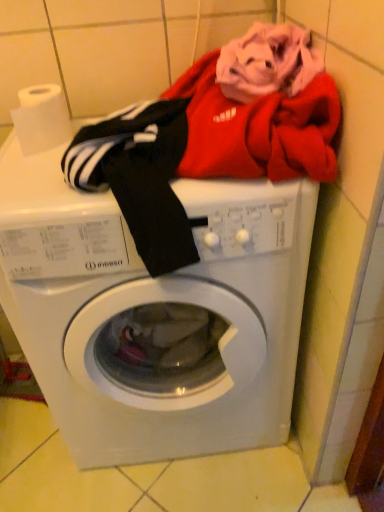
Question: From a real-world perspective, is white matte toilet paper at upper left physically above white plastic washing machine at center?

Choices:
 (A) no
 (B) yes

Answer: (B)

Question: Does white matte toilet paper at upper left have a larger size compared to white plastic washing machine at center?

Choices:
 (A) no
 (B) yes

Answer: (A)

Question: Does white matte toilet paper at upper left have a greater height compared to white plastic washing machine at center?

Choices:
 (A) no
 (B) yes

Answer: (A)

Question: From the image's perspective, is white matte toilet paper at upper left under white plastic washing machine at center?

Choices:
 (A) yes
 (B) no

Answer: (B)

Question: Considering the relative positions of white matte toilet paper at upper left and white plastic washing machine at center in the image provided, is white matte toilet paper at upper left to the left of white plastic washing machine at center from the viewer's perspective?

Choices:
 (A) yes
 (B) no

Answer: (A)

Question: Does white matte toilet paper at upper left turn towards white plastic washing machine at center?

Choices:
 (A) no
 (B) yes

Answer: (A)

Question: Could white matte toilet paper at upper left be considered to be inside white plastic washing machine at center?

Choices:
 (A) no
 (B) yes

Answer: (A)

Question: Does white plastic washing machine at center have a smaller size compared to white matte toilet paper at upper left?

Choices:
 (A) yes
 (B) no

Answer: (B)

Question: From the image's perspective, is white plastic washing machine at center on top of white matte toilet paper at upper left?

Choices:
 (A) no
 (B) yes

Answer: (A)

Question: Would you consider white plastic washing machine at center to be distant from white matte toilet paper at upper left?

Choices:
 (A) yes
 (B) no

Answer: (B)

Question: From a real-world perspective, is white plastic washing machine at center positioned under white matte toilet paper at upper left based on gravity?

Choices:
 (A) no
 (B) yes

Answer: (B)

Question: Can you confirm if white plastic washing machine at center is wider than white matte toilet paper at upper left?

Choices:
 (A) no
 (B) yes

Answer: (B)

Question: Is point (54, 160) closer or farther from the camera than point (21, 116)?

Choices:
 (A) farther
 (B) closer

Answer: (B)